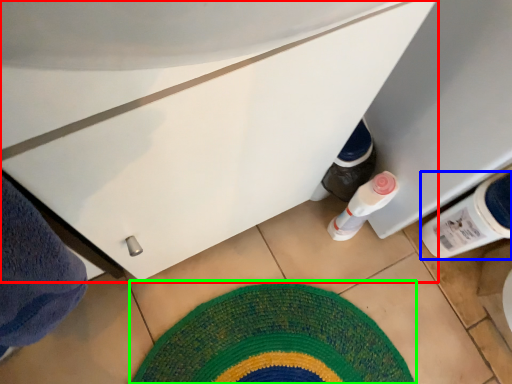
Question: Which is nearer to the cabinetry (highlighted by a red box)? bottle (highlighted by a blue box) or mat (highlighted by a green box).

Choices:
 (A) bottle
 (B) mat

Answer: (A)